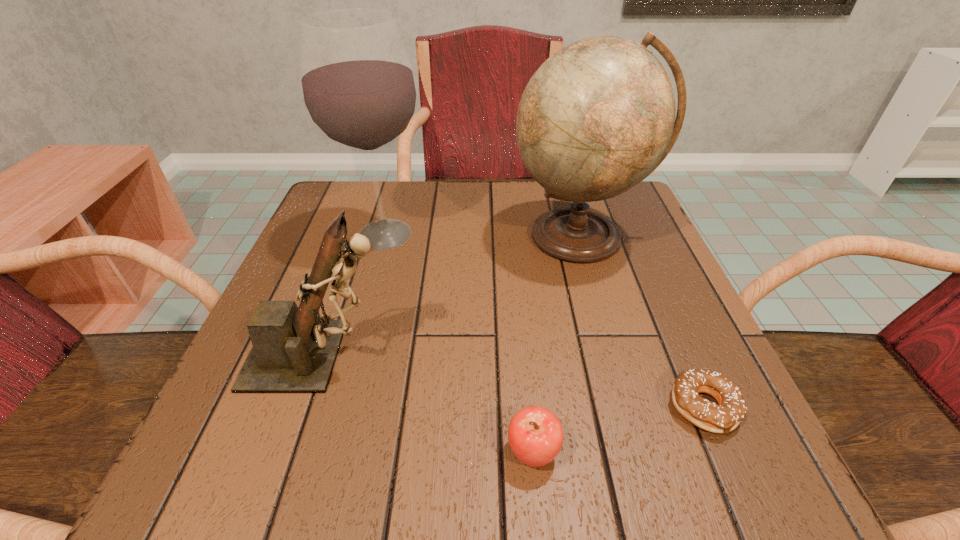
Find the location of `free area in between the figurine and the apple`. free area in between the figurine and the apple is located at coordinates (427, 404).

Find the location of a particular element. The image size is (960, 540). unoccupied area between the second shortest object and the globe is located at coordinates (556, 345).

You are a GUI agent. You are given a task and a screenshot of the screen. Output one action in this format:
    pyautogui.click(x=<x>, y=<y>)
    Task: Click on the empty space that is in between the alcohol and the shortest object
    This screenshot has width=960, height=540.
    Given the screenshot: What is the action you would take?
    pyautogui.click(x=544, y=321)

At what (x,y) coordinates should I click in order to perform the action: click on vacant point located between the alcohol and the second shortest object. Please return your answer as a coordinate pair (x, y). This screenshot has height=540, width=960. Looking at the image, I should click on (459, 343).

The image size is (960, 540). What are the coordinates of `free space between the apple and the figurine` in the screenshot? It's located at (427, 404).

I want to click on free spot between the shortest object and the alcohol, so click(x=544, y=321).

The height and width of the screenshot is (540, 960). Identify the location of vacant space in between the third shortest object and the globe. coord(450,296).

What are the coordinates of `object that is the second closest to the alcohol` in the screenshot? It's located at (598, 116).

Identify which object is the third closest to the second shortest object. Please provide its 2D coordinates. Your answer should be formatted as a tuple, i.e. [(x, y)], where the tuple contains the x and y coordinates of a point satisfying the conditions above.

[(598, 116)]

Locate an element on the screen. This screenshot has height=540, width=960. vacant space that satisfies the following two spatial constraints: 1. on the front-facing side of the globe; 2. on the front-facing side of the third tallest object is located at coordinates (613, 355).